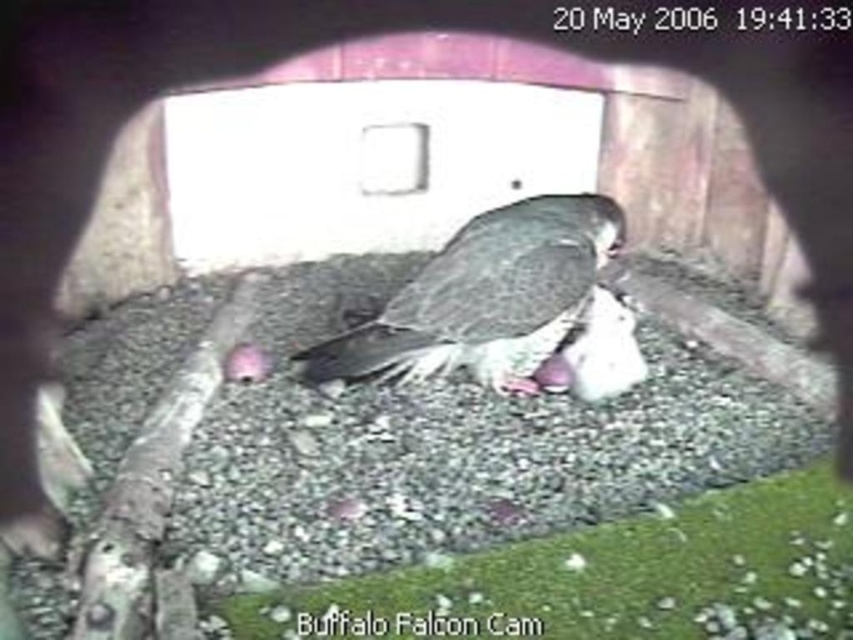
Who is positioned more to the left, gray gravel at center or dark gray feathers at center?

Positioned to the left is gray gravel at center.

The width and height of the screenshot is (853, 640). What do you see at coordinates (456, 444) in the screenshot?
I see `gray gravel at center` at bounding box center [456, 444].

This screenshot has height=640, width=853. I want to click on gray gravel at center, so click(456, 444).

At what (x,y) coordinates should I click in order to perform the action: click on gray gravel at center. Please return your answer as a coordinate pair (x, y). This screenshot has width=853, height=640. Looking at the image, I should click on (456, 444).